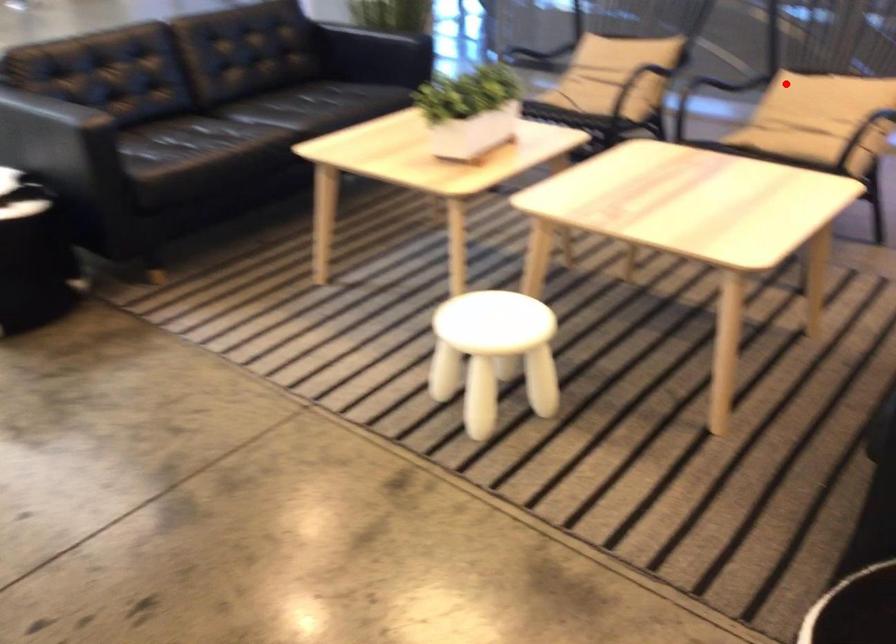
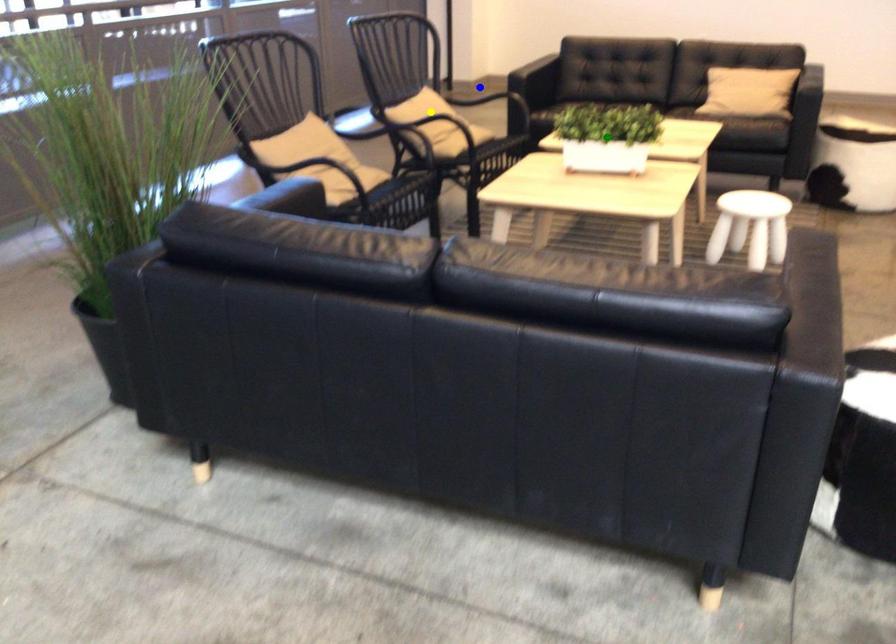
Question: I am providing you with two images of the same scene from different viewpoints. A red point is marked on the first image. You are given multiple points on the second image. Which mark in image 2 goes with the point in image 1?

Choices:
 (A) blue point
 (B) yellow point
 (C) green point

Answer: (B)